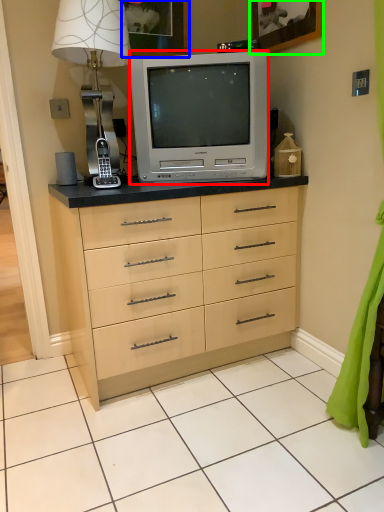
Question: Considering the real-world distances, which object is farthest from television (highlighted by a red box)? picture frame (highlighted by a blue box) or picture frame (highlighted by a green box)?

Choices:
 (A) picture frame
 (B) picture frame

Answer: (A)